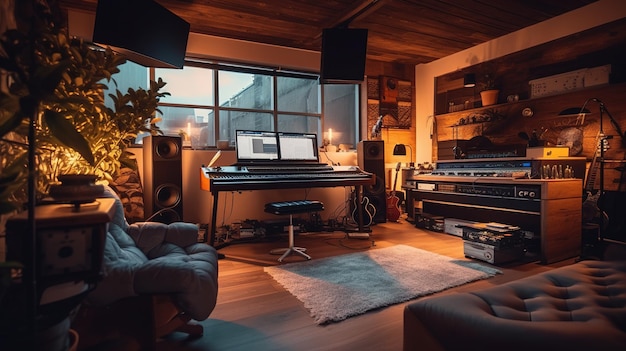
In order to click on stool in this screenshot , I will do `click(300, 205)`.